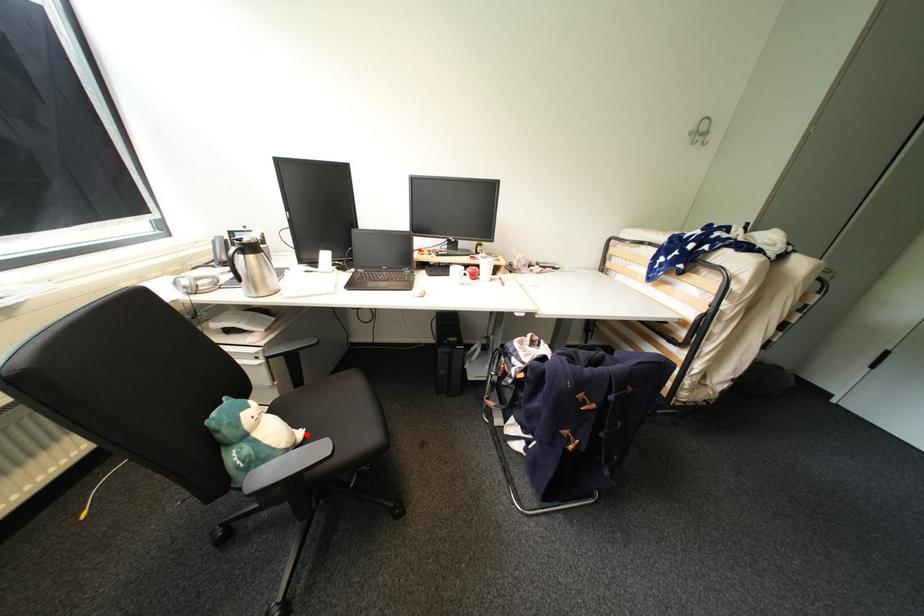
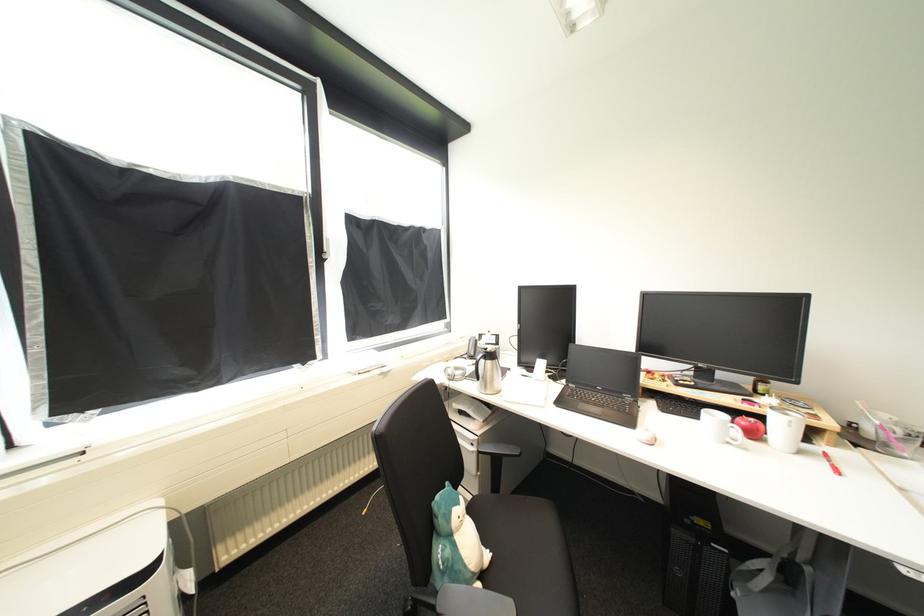
Find the pixel in the second image that matches the highlighted location in the first image.

(493, 557)